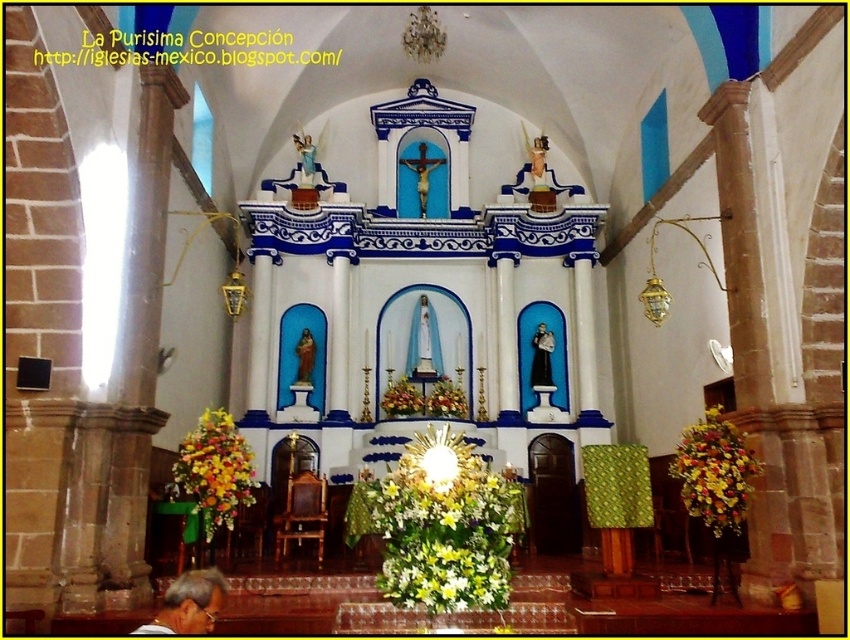
Who is more forward, (459, 588) or (221, 422)?

Point (459, 588)

Who is more distant from viewer, (389, 548) or (197, 500)?

The point (197, 500) is more distant.

The height and width of the screenshot is (640, 850). Identify the location of yellow-green floral bouquet at center. (445, 525).

Is yellow-green floral bouquet at center below yellow fabric floral arrangement at right?

Yes, yellow-green floral bouquet at center is below yellow fabric floral arrangement at right.

You are a GUI agent. You are given a task and a screenshot of the screen. Output one action in this format:
    pyautogui.click(x=<x>, y=<y>)
    Task: Click on the yellow-green floral bouquet at center
    The width and height of the screenshot is (850, 640).
    Given the screenshot: What is the action you would take?
    pyautogui.click(x=445, y=525)

Measure the distance between yellow-green floral bouquet at center and camera.

The distance of yellow-green floral bouquet at center from camera is 39.63 meters.

Where is `yellow-green floral bouquet at center`? Image resolution: width=850 pixels, height=640 pixels. yellow-green floral bouquet at center is located at coordinates (445, 525).

Does yellow fabric floral arrangement at right appear under yellow fabric floral arrangement at lower left?

Correct, yellow fabric floral arrangement at right is located below yellow fabric floral arrangement at lower left.

At what (x,y) coordinates should I click in order to perform the action: click on yellow fabric floral arrangement at right. Please return your answer as a coordinate pair (x, y). The image size is (850, 640). Looking at the image, I should click on (715, 472).